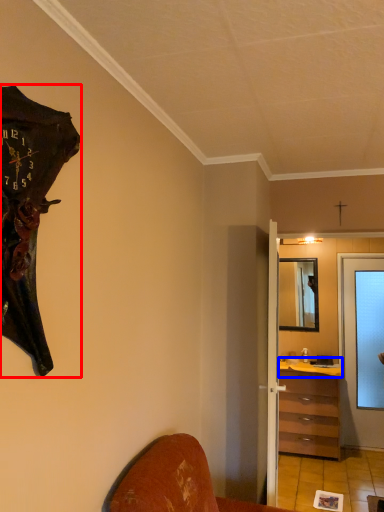
Question: Which of the following is the closest to the observer, wall clock (highlighted by a red box) or counter top (highlighted by a blue box)?

Choices:
 (A) wall clock
 (B) counter top

Answer: (A)